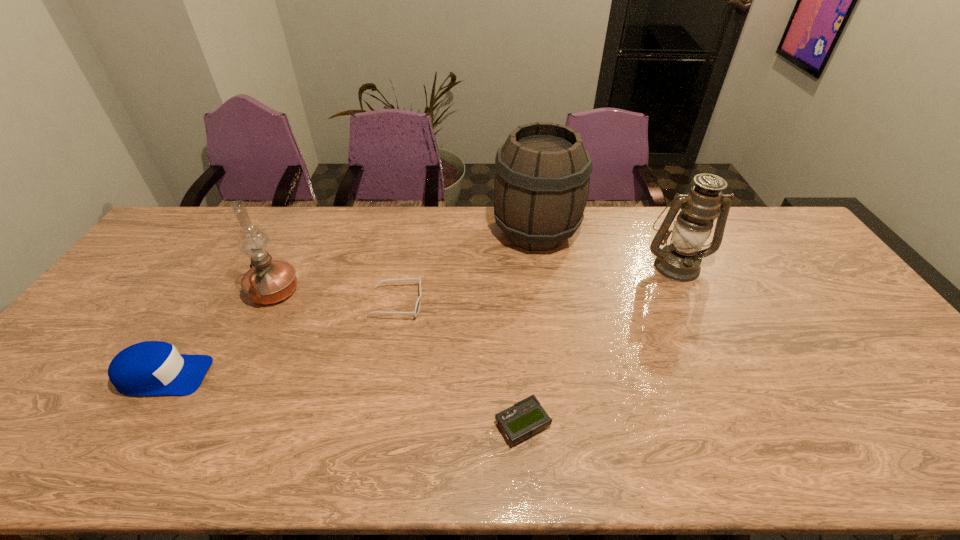
The width and height of the screenshot is (960, 540). What are the coordinates of `vacant area that lies between the left oil lamp and the rightmost object` in the screenshot? It's located at (475, 279).

Identify the location of vacant space in between the fifth farthest object and the wine bucket. This screenshot has width=960, height=540. (349, 304).

At what (x,y) coordinates should I click in order to perform the action: click on free point between the baseball cap and the wine bucket. Please return your answer as a coordinate pair (x, y). The height and width of the screenshot is (540, 960). Looking at the image, I should click on (349, 304).

Find the location of a particular element. object that is the closest to the left oil lamp is located at coordinates (148, 368).

The image size is (960, 540). I want to click on object that is the third closest to the shortest object, so click(x=680, y=261).

Where is `vacant region that satisfies the following two spatial constraints: 1. on the front side of the wine bucket; 2. with the lenses of the fifth tallest object facing outward`? This screenshot has width=960, height=540. vacant region that satisfies the following two spatial constraints: 1. on the front side of the wine bucket; 2. with the lenses of the fifth tallest object facing outward is located at coordinates (547, 303).

In order to click on blank space that satisfies the following two spatial constraints: 1. on the front side of the rightmost object; 2. with the lenses of the third object from left to right facing outward in this screenshot , I will do pos(694,303).